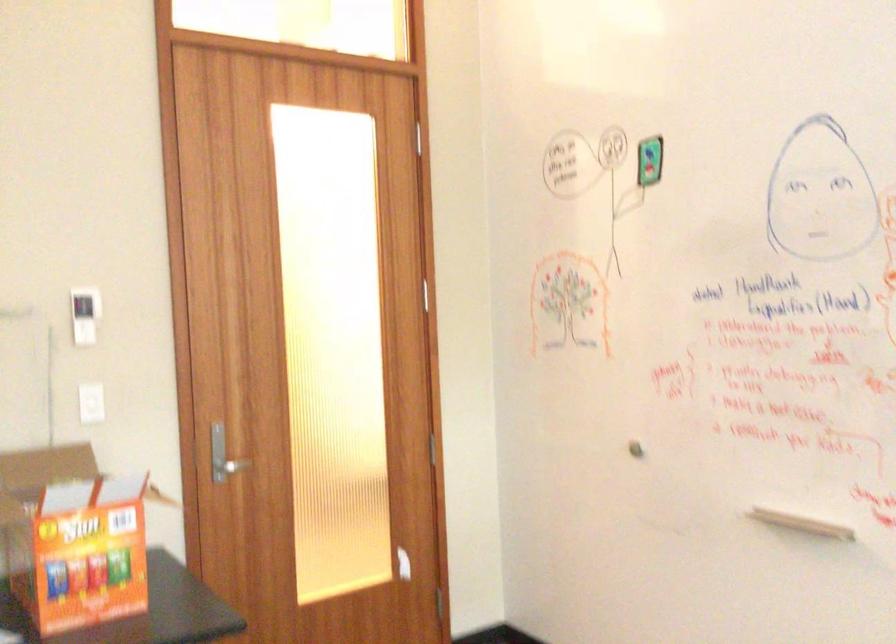
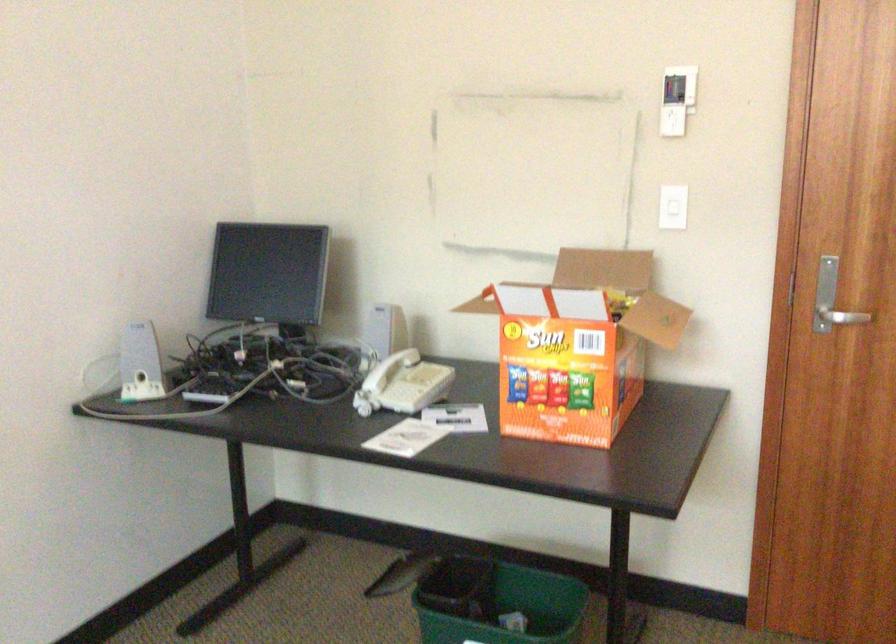
Locate, in the second image, the point that corresponds to pixel 85 408 in the first image.

(672, 214)